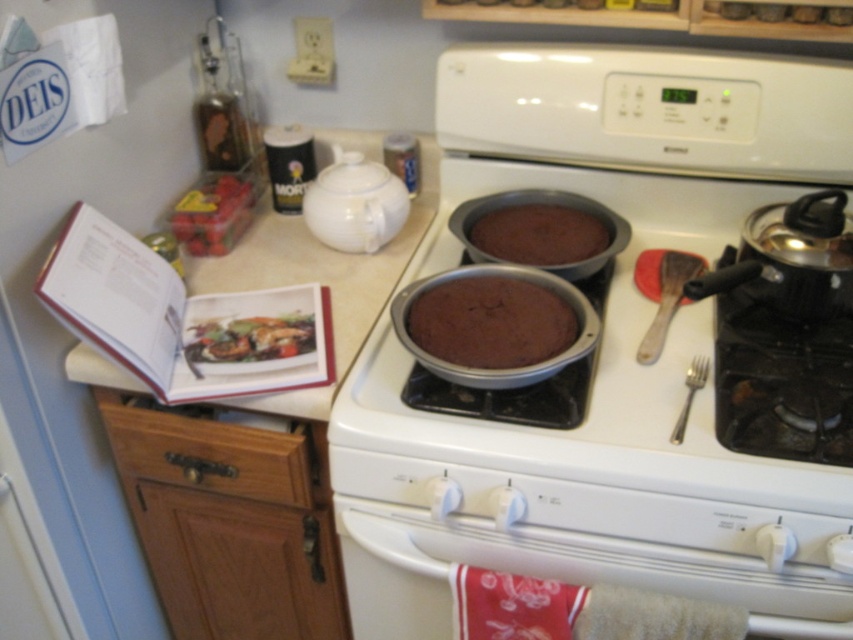
Looking at this image, you are a chef preparing to serve a meal. You see the shiny brown meat at center and the satin silver fork at lower right. Which item is positioned higher in the image?

The shiny brown meat at center is located above the satin silver fork at lower right, so it is positioned higher in the image.

You are a chef holding a measuring spoon that is 15 centimeters long. You want to reach the shiny red berries at left from where you are standing. Can you reach them without moving your feet?

The distance between you and the shiny red berries at left is 1.31 meters. Since the measuring spoon is only 15 centimeters long, you cannot extend your reach enough to get the berries without moving closer.

You are standing in the kitchen and want to reach the point at coordinates (312, 332). If your arm can extend 1.2 meters, can you comfortably reach that point?

The point at coordinates (312, 332) is 1.11 meters from the viewer, so yes, you can comfortably reach it since your arm can extend 1.2 meters which is longer than the distance required.